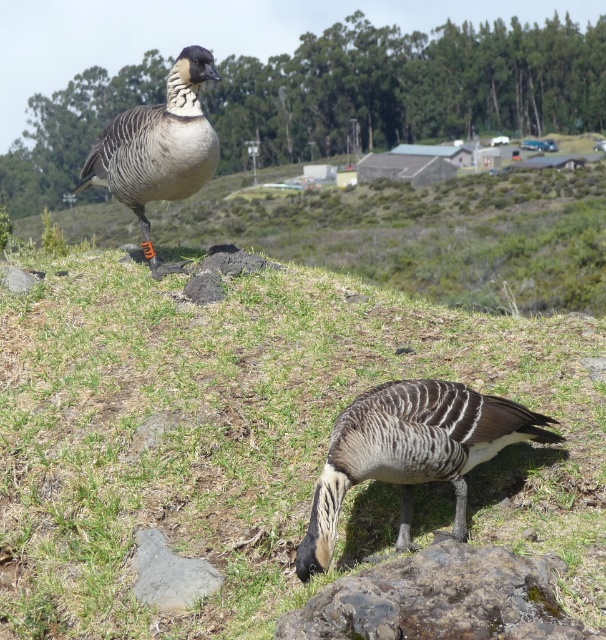
Which of these two, green grass at upper center or brown feathered goose at upper left, stands taller?

green grass at upper center is taller.

Does green grass at upper center appear under brown feathered goose at upper left?

Correct, green grass at upper center is located below brown feathered goose at upper left.

Is point (255, 291) closer to camera compared to point (167, 99)?

No, (255, 291) is behind (167, 99).

Identify the location of green grass at upper center. This screenshot has width=606, height=640. (255, 438).

Is gray-feathered goose at lower center in front of brown feathered goose at upper left?

Yes, it is in front of brown feathered goose at upper left.

Locate an element on the screen. gray-feathered goose at lower center is located at coordinates (410, 451).

Which is more to the left, green grass at upper center or gray-feathered goose at lower center?

green grass at upper center

Who is more forward, (522,452) or (481,419)?

Point (481,419)

Identify the location of green grass at upper center. This screenshot has width=606, height=640. (255, 438).